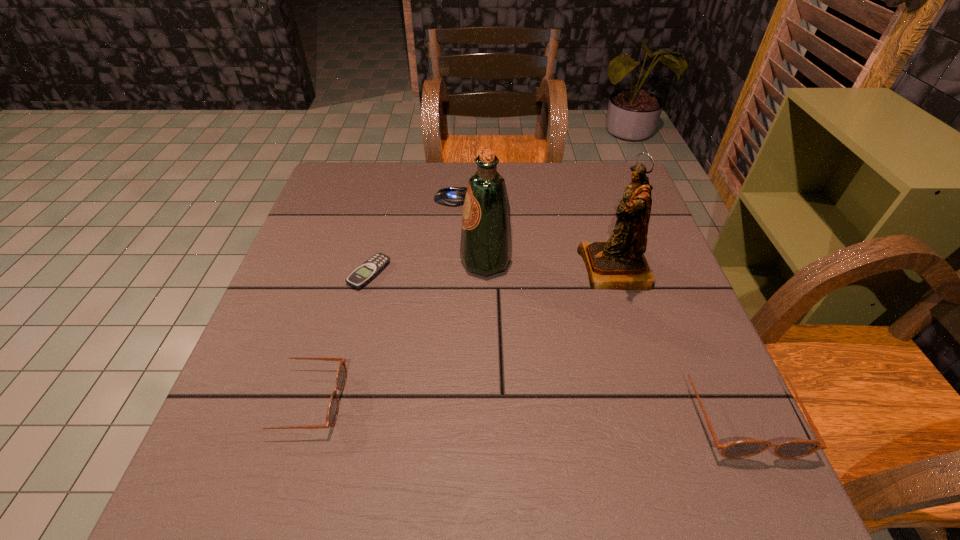
In order to click on beeper that is at the left edge in this screenshot , I will do `click(365, 273)`.

At what (x,y) coordinates should I click in order to perform the action: click on sunglasses positioned at the right edge. Please return your answer as a coordinate pair (x, y). Looking at the image, I should click on (793, 449).

I want to click on figurine present at the right edge, so click(x=618, y=264).

What are the coordinates of `object that is at the near left corner` in the screenshot? It's located at (332, 412).

This screenshot has width=960, height=540. What are the coordinates of `object situated at the near right corner` in the screenshot? It's located at (793, 449).

Identify the location of vacant region at the far edge of the desktop. (466, 180).

In the image, there is a desktop. In order to click on vacant space at the near edge in this screenshot , I will do `click(359, 409)`.

In the image, there is a desktop. Where is `vacant space at the right edge`? vacant space at the right edge is located at coordinates (614, 225).

Image resolution: width=960 pixels, height=540 pixels. In the image, there is a desktop. Identify the location of vacant space at the far left corner. (375, 195).

Find the location of `vacant region at the near left corner`. vacant region at the near left corner is located at coordinates (257, 413).